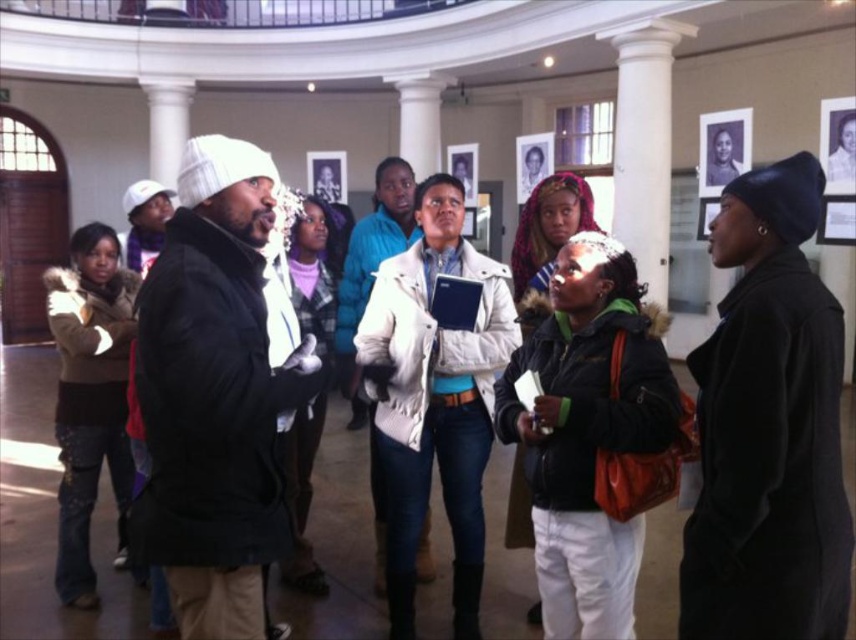
Question: Can you confirm if light beige jacket at center is smaller than brown fuzzy jacket at left?

Choices:
 (A) yes
 (B) no

Answer: (B)

Question: Which point is closer to the camera taking this photo?

Choices:
 (A) (111, 356)
 (B) (623, 372)

Answer: (B)

Question: Does black woolen beanie at upper right have a larger size compared to white knit hat at center?

Choices:
 (A) yes
 (B) no

Answer: (B)

Question: From the image, what is the correct spatial relationship of green fuzzy jacket at center in relation to light beige jacket at center?

Choices:
 (A) below
 (B) above

Answer: (A)

Question: Estimate the real-world distances between objects in this image. Which object is closer to the light beige jacket at center?

Choices:
 (A) brown fuzzy jacket at left
 (B) white knit hat at center

Answer: (B)

Question: Which object is farther from the camera taking this photo?

Choices:
 (A) brown fuzzy jacket at left
 (B) black woolen beanie at upper right
 (C) green fuzzy jacket at center
 (D) white knit hat at center

Answer: (A)